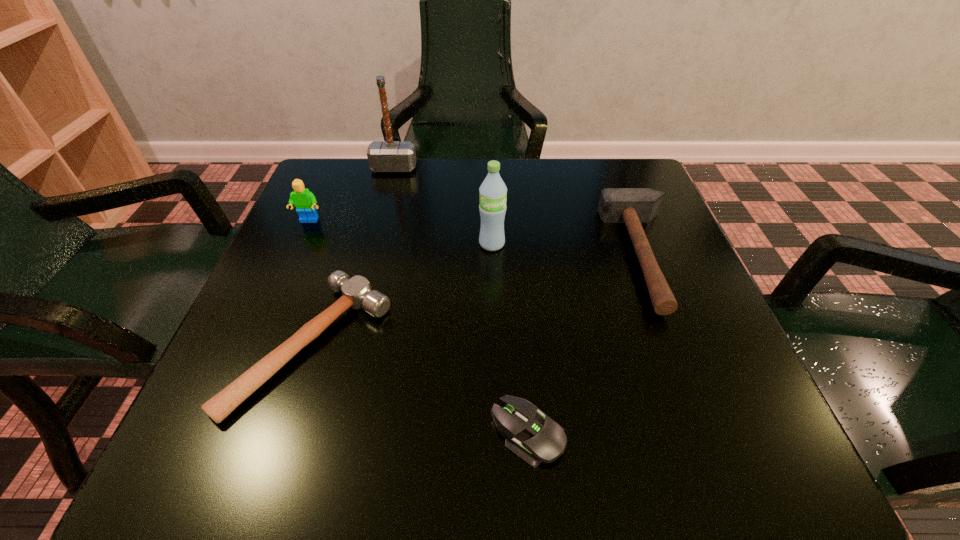
Locate an element on the screen. Image resolution: width=960 pixels, height=540 pixels. the farthest hammer is located at coordinates (383, 156).

Locate an element on the screen. the tallest hammer is located at coordinates (383, 156).

What are the coordinates of `water bottle` in the screenshot? It's located at (493, 192).

Locate an element on the screen. Lego is located at coordinates (304, 200).

Find the location of a particular element. the second tallest hammer is located at coordinates (632, 206).

Identify the location of the rightmost hammer. Image resolution: width=960 pixels, height=540 pixels. (632, 206).

Where is `the second shortest object`? The height and width of the screenshot is (540, 960). the second shortest object is located at coordinates (357, 293).

Find the location of `the shortest object`. the shortest object is located at coordinates pyautogui.click(x=536, y=438).

You are a GUI agent. You are given a task and a screenshot of the screen. Output one action in this format:
    pyautogui.click(x=<x>, y=<y>)
    Task: Click on the vacant area situated on the striking surface of the tallest hammer
    The height and width of the screenshot is (540, 960).
    Given the screenshot: What is the action you would take?
    pyautogui.click(x=368, y=269)

Where is `free space located 0.050m on the back of the water bottle`? free space located 0.050m on the back of the water bottle is located at coordinates (492, 221).